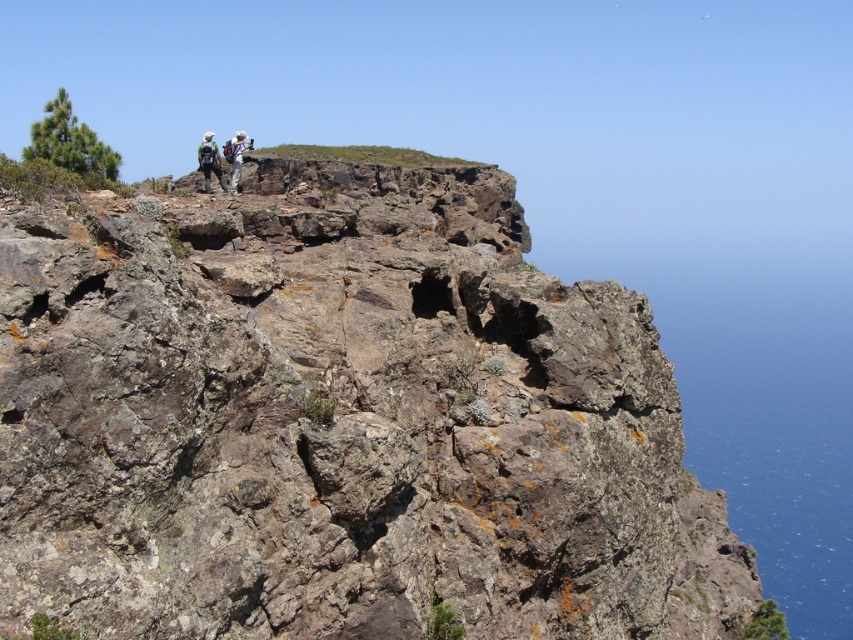
In the scene shown: Does rocky at upper center have a greater height compared to white fabric backpack at upper center?

Yes, rocky at upper center is taller than white fabric backpack at upper center.

Between point (305, 420) and point (244, 138), which one is positioned in front?

Point (305, 420)

Identify the location of rocky at upper center. (340, 422).